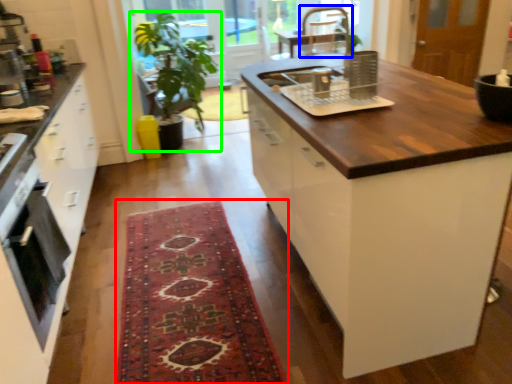
Question: Estimate the real-world distances between objects in this image. Which object is closer to mat (highlighted by a red box), chair (highlighted by a blue box) or houseplant (highlighted by a green box)?

Choices:
 (A) chair
 (B) houseplant

Answer: (B)